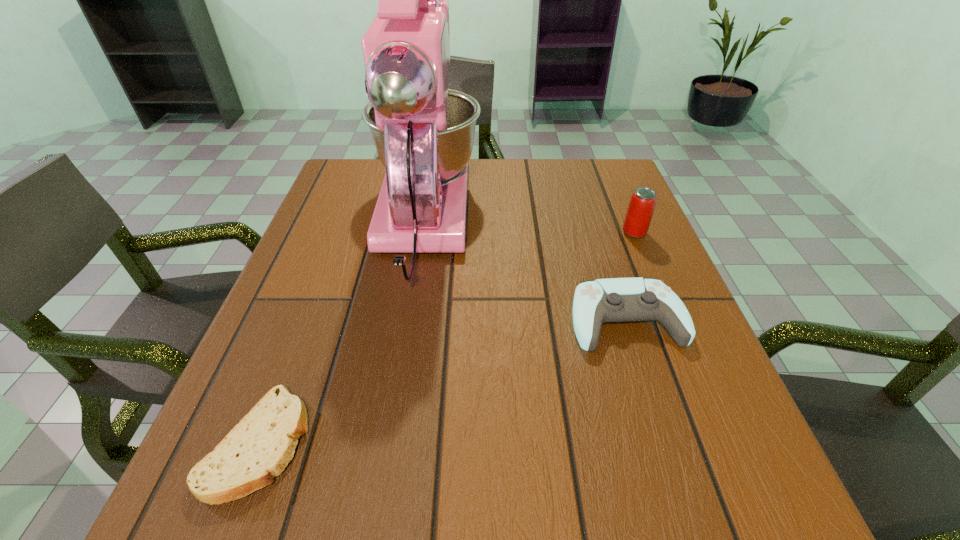
Identify the location of mixer that is positioned at the left edge. The height and width of the screenshot is (540, 960). (423, 132).

Where is `pita bread at the left edge`? The width and height of the screenshot is (960, 540). pita bread at the left edge is located at coordinates (261, 445).

Where is `beer can present at the right edge`? beer can present at the right edge is located at coordinates (643, 200).

I want to click on control that is at the right edge, so click(x=595, y=302).

Image resolution: width=960 pixels, height=540 pixels. Find the location of `object situated at the far left corner`. object situated at the far left corner is located at coordinates (423, 132).

This screenshot has width=960, height=540. Identify the location of object that is at the near left corner. (261, 445).

Find the location of `vacant space at the far edge of the desktop`. vacant space at the far edge of the desktop is located at coordinates (475, 161).

Locate an element on the screen. free space at the near edge of the desktop is located at coordinates (420, 505).

Where is `vacant area at the left edge of the desktop`? The image size is (960, 540). vacant area at the left edge of the desktop is located at coordinates (284, 295).

Identify the location of free space at the near left corner. This screenshot has height=540, width=960. (296, 518).